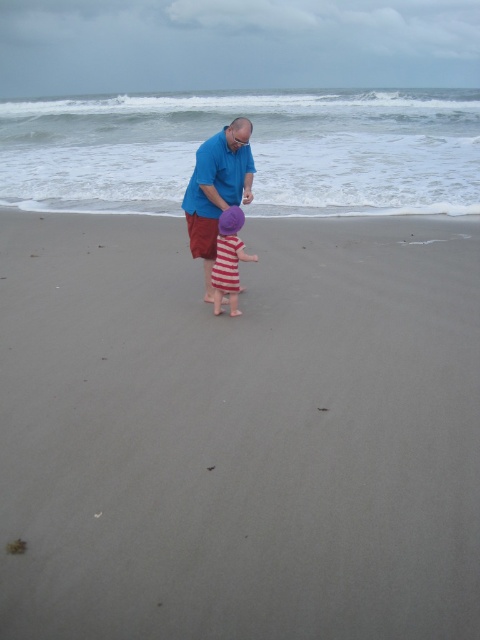
You are a photographer trying to capture a photo of both the blue cotton shirt at center and the striped fabric dress at center in the same frame. Based on their positions and sizes, which one should you focus on first to ensure both are in the frame?

The blue cotton shirt at center might be wider than striped fabric dress at center, so you should focus on the blue cotton shirt at center first to ensure both are in the frame.

You are a photographer planning to capture a wide shot of the beach scene. Given that the smooth sand at center and the blue cotton shirt at center are both in the frame, which object occupies more horizontal space in the image?

The smooth sand at center occupies more horizontal space in the image because its width is larger than that of the blue cotton shirt at center.

You are a photographer trying to capture both the blue cotton shirt at center and the striped fabric dress at center in a single shot. Based on their positions, can you ensure that both are fully visible in your photo?

The striped fabric dress at center is behind the blue cotton shirt at center, so the blue cotton shirt at center may block part of the striped fabric dress at center in the photo, making it not fully visible.